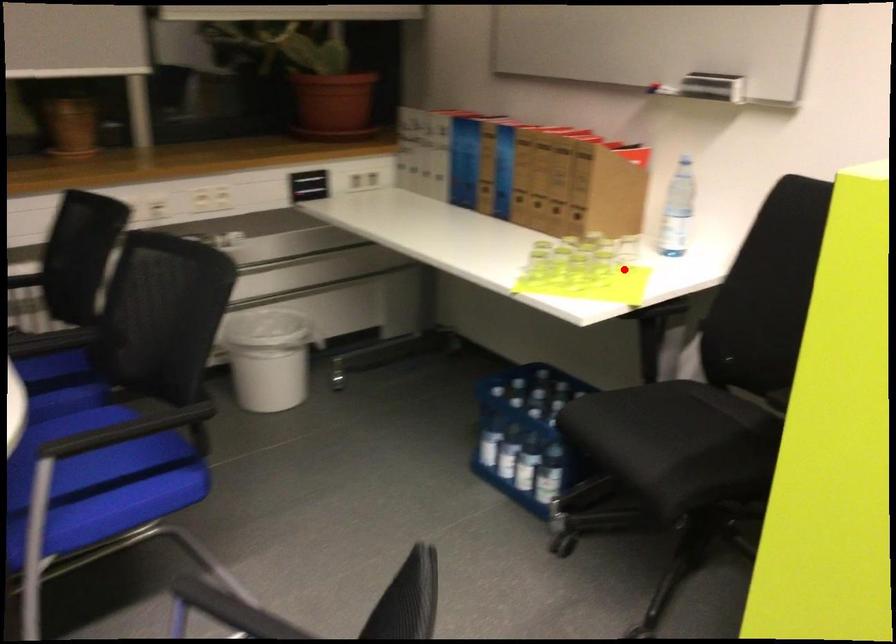
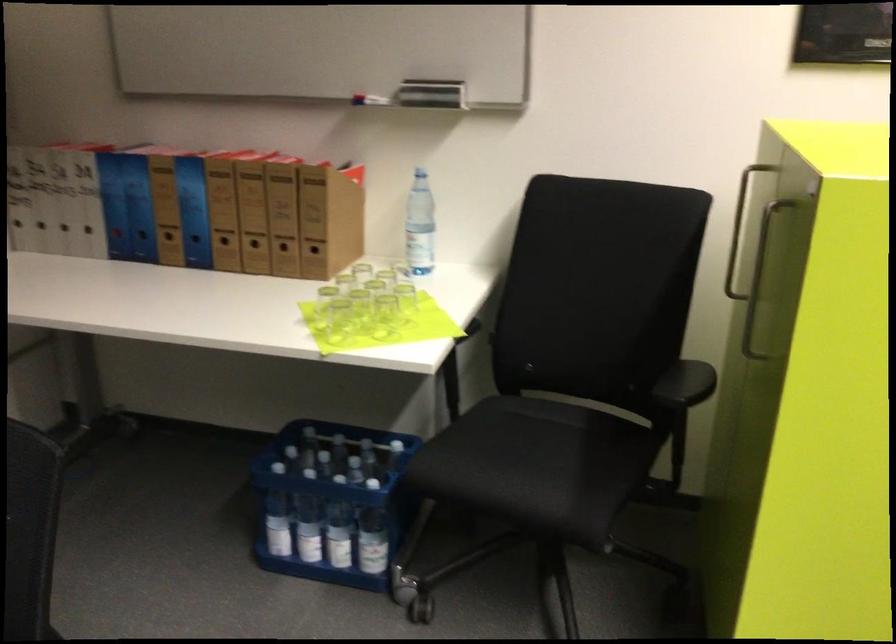
In the second image, find the point that corresponds to the highlighted location in the first image.

(405, 299)